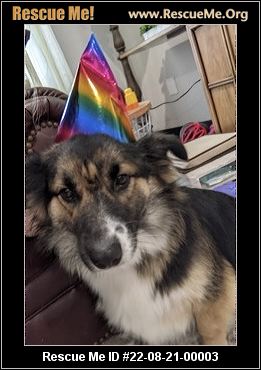
I want to click on brown chair, so click(x=36, y=115).